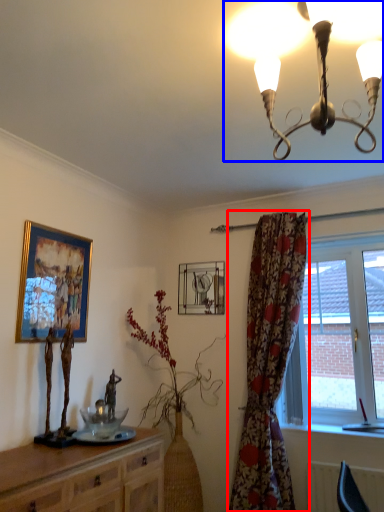
Question: Which of the following is the farthest to the observer, curtain (highlighted by a red box) or lamp (highlighted by a blue box)?

Choices:
 (A) curtain
 (B) lamp

Answer: (A)